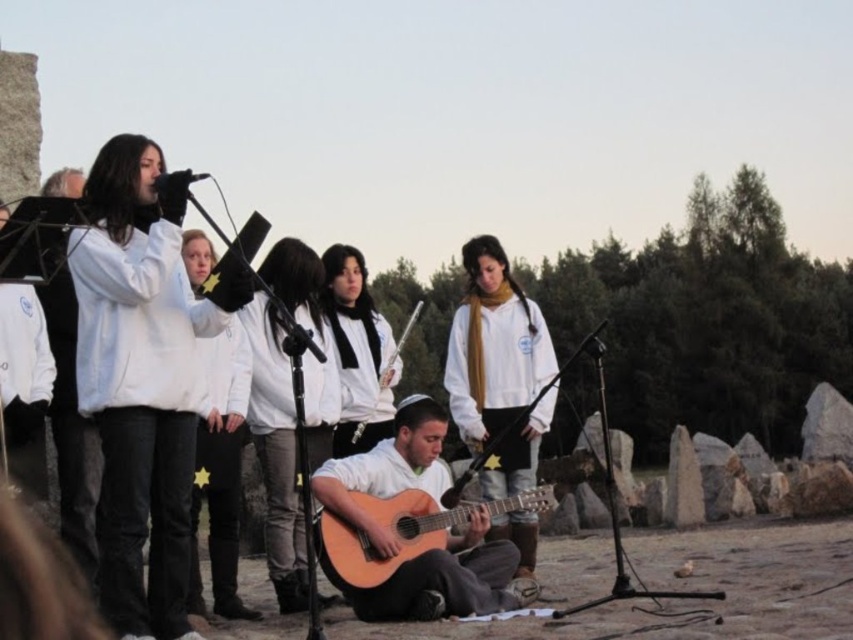
Question: Does white matte jacket at center have a smaller size compared to white fleece jacket at center?

Choices:
 (A) no
 (B) yes

Answer: (A)

Question: Does light brown acoustic guitar at center have a smaller size compared to white matte scarf at center?

Choices:
 (A) no
 (B) yes

Answer: (B)

Question: Which of the following is the closest to the observer?

Choices:
 (A) (231, 568)
 (B) (462, 512)
 (C) (503, 401)

Answer: (B)

Question: Which point is closer to the camera?

Choices:
 (A) (410, 442)
 (B) (315, 550)

Answer: (B)

Question: Where is white matte scarf at center located in relation to light brown wooden guitar at center in the image?

Choices:
 (A) right
 (B) left

Answer: (A)

Question: Estimate the real-world distances between objects in this image. Which object is closer to the light brown acoustic guitar at center?

Choices:
 (A) white matte jacket at center
 (B) white matte scarf at center
 (C) light brown wooden guitar at center
 (D) white fleece jacket at center

Answer: (C)